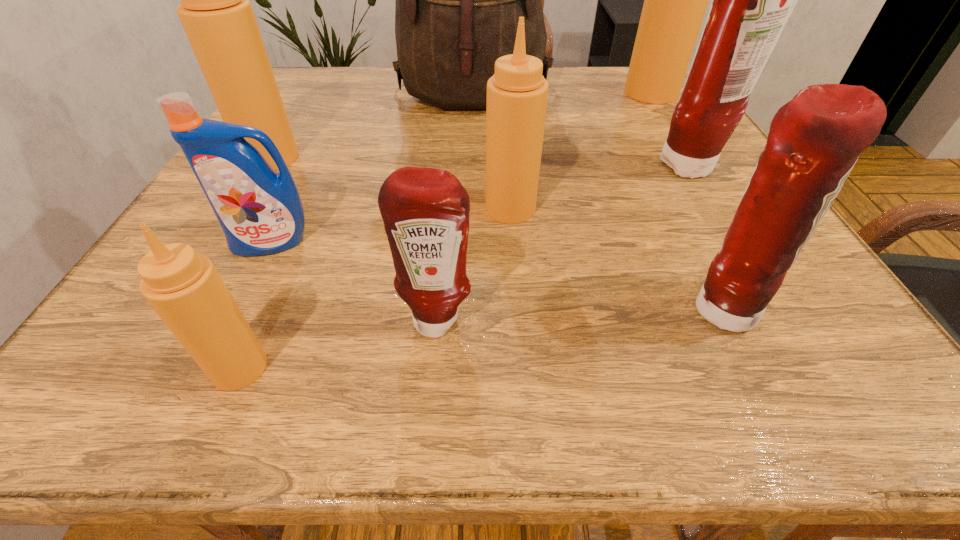
Where is `vacant point at the left edge`? Image resolution: width=960 pixels, height=540 pixels. vacant point at the left edge is located at coordinates (298, 157).

Where is `vacant space at the right edge of the desktop`? vacant space at the right edge of the desktop is located at coordinates (733, 216).

Where is `free region at the near left corner of the desktop`? free region at the near left corner of the desktop is located at coordinates (180, 383).

This screenshot has height=540, width=960. I want to click on free area in between the detergent and the second smallest red condiment, so click(x=495, y=276).

At what (x,y) coordinates should I click in order to perform the action: click on vacant region between the third farthest tan condiment and the smallest tan condiment. Please return your answer as a coordinate pair (x, y). Looking at the image, I should click on (375, 288).

Where is `free space between the detergent and the backpack`? free space between the detergent and the backpack is located at coordinates (372, 169).

Find the location of a particular element. vacant region between the biggest tan condiment and the backpack is located at coordinates (562, 94).

Where is `free area in between the detergent and the smallest red condiment`? This screenshot has width=960, height=540. free area in between the detergent and the smallest red condiment is located at coordinates (354, 281).

Locate an element on the screen. Image resolution: width=960 pixels, height=540 pixels. unoccupied area between the backpack and the nearest condiment is located at coordinates (356, 231).

Find the location of a particular element. The height and width of the screenshot is (540, 960). empty space between the detergent and the second smallest red condiment is located at coordinates (495, 276).